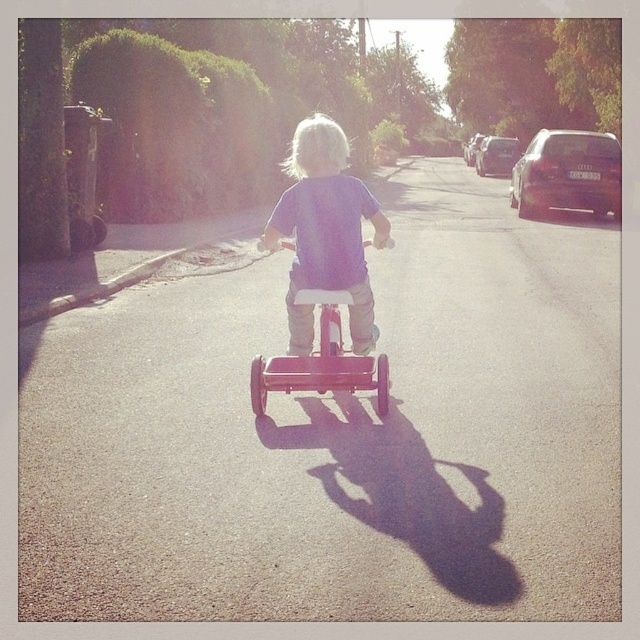
In the scene shown: Is matte black car at upper right thinner than metallic silver car at right?

Incorrect, matte black car at upper right's width is not less than metallic silver car at right's.

Does matte black car at upper right have a greater height compared to metallic silver car at right?

Correct, matte black car at upper right is much taller as metallic silver car at right.

Is point (605, 156) farther from viewer compared to point (513, 140)?

No.

The image size is (640, 640). In order to click on matte black car at upper right in this screenshot , I will do `click(566, 173)`.

In the scene shown: Who is more distant from viewer, (x=520, y=163) or (x=326, y=330)?

Point (x=520, y=163)

Looking at this image, is matte black car at upper right to the left of matte red tricycle at center from the viewer's perspective?

No, matte black car at upper right is not to the left of matte red tricycle at center.

The height and width of the screenshot is (640, 640). Describe the element at coordinates (566, 173) in the screenshot. I see `matte black car at upper right` at that location.

Locate an element on the screen. The width and height of the screenshot is (640, 640). matte black car at upper right is located at coordinates (566, 173).

Does purple matte shirt at center come behind matte black car at upper right?

No, purple matte shirt at center is closer to the viewer.

What do you see at coordinates (324, 230) in the screenshot? I see `purple matte shirt at center` at bounding box center [324, 230].

Locate an element on the screen. purple matte shirt at center is located at coordinates (324, 230).